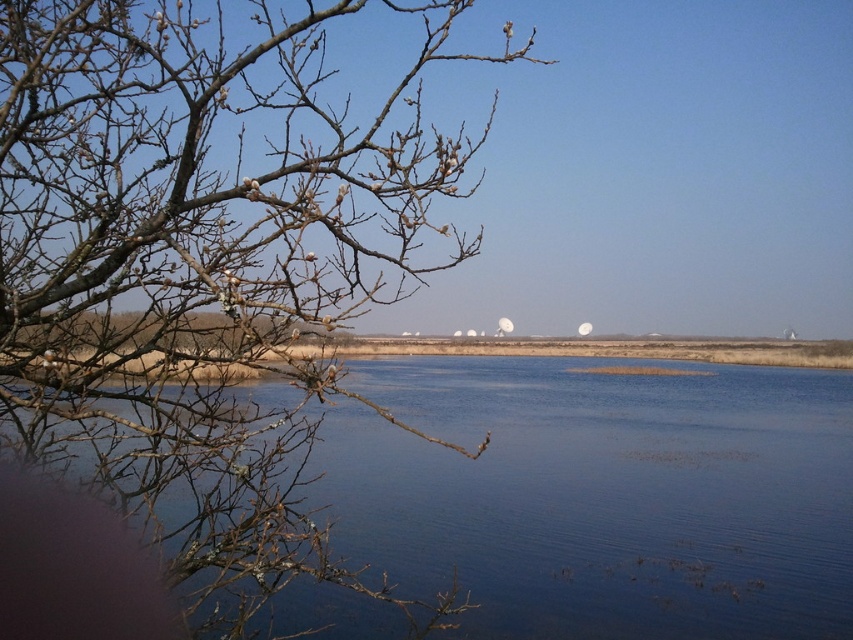
You are standing in the serene landscape and want to take a photo of the bare branches at left. Where should you position yourself to capture them in the frame?

To capture the bare branches at left in your photo, position yourself so that the branches are centered at the coordinates corresponding to point 0.409 on the horizontal axis and 0.234 on the vertical axis of the image frame.

You are a bird flying over the serene landscape. You see the bare branches at left and the blue water at center. Which object would appear larger to you from your current position?

The blue water at center appears larger than the bare branches at left because it is bigger in size.

In the scene shown: You are standing on the edge of the water and want to take a photo of the bare branches at left and the blue water at center. Which object is closer to your current position?

The blue water at center is closer to your current position because you are standing on the edge of the water, and the bare branches at left is to the left of blue water at center, meaning it is further away from you.